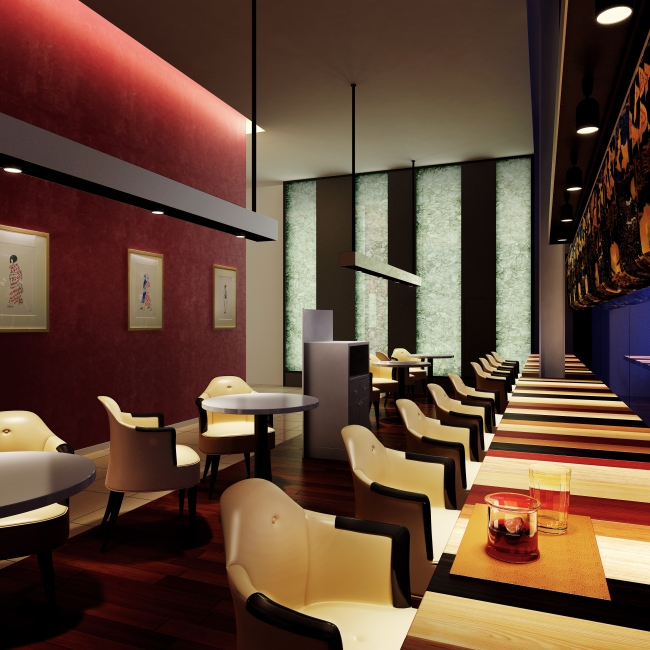
At what (x,y) coordinates should I click in order to perform the action: click on floor. Please return your answer as a coordinate pair (x, y). The height and width of the screenshot is (650, 650). Looking at the image, I should click on (175, 591).